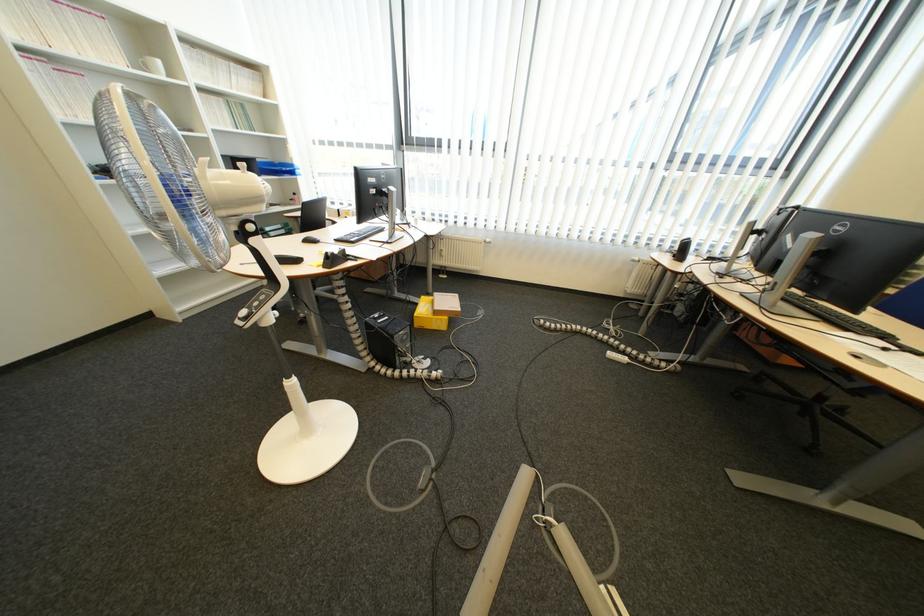
Image resolution: width=924 pixels, height=616 pixels. What do you see at coordinates (604, 342) in the screenshot?
I see `the fan control buttons` at bounding box center [604, 342].